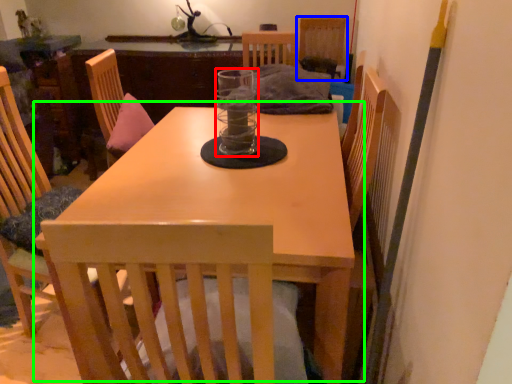
Question: Which object is the closest to the glass jar (highlighted by a red box)? Choose among these: chair (highlighted by a blue box) or table (highlighted by a green box).

Choices:
 (A) chair
 (B) table

Answer: (B)